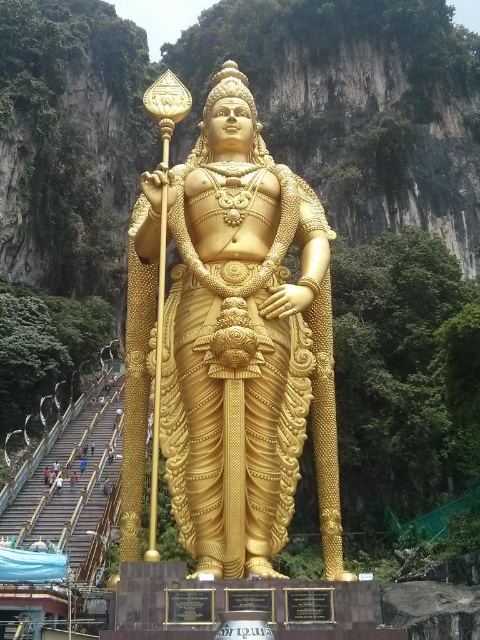
Between point (232, 522) and point (60, 483), which one is positioned behind?

Point (60, 483)

Is gold polished statue at center shorter than golden statue at center?

Incorrect, gold polished statue at center's height does not fall short of golden statue at center's.

Does point (295, 236) come farther from viewer compared to point (57, 480)?

That is False.

The height and width of the screenshot is (640, 480). I want to click on gold polished statue at center, so click(231, 346).